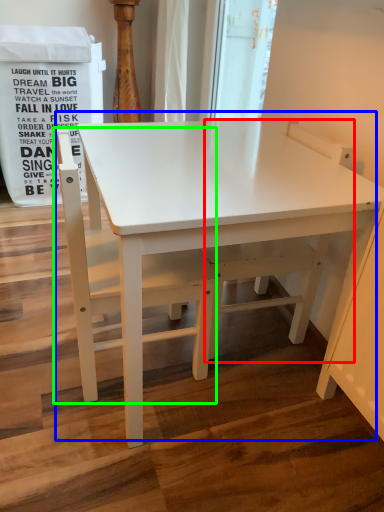
Question: Which object is positioned farthest from swivel chair (highlighted by a red box)? Select from table (highlighted by a blue box) and chair (highlighted by a green box).

Choices:
 (A) table
 (B) chair

Answer: (B)